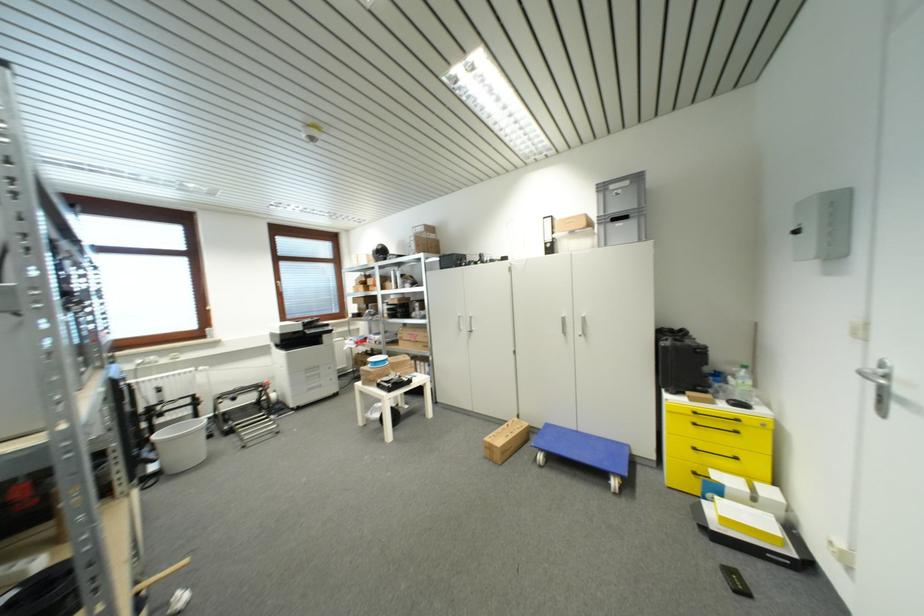
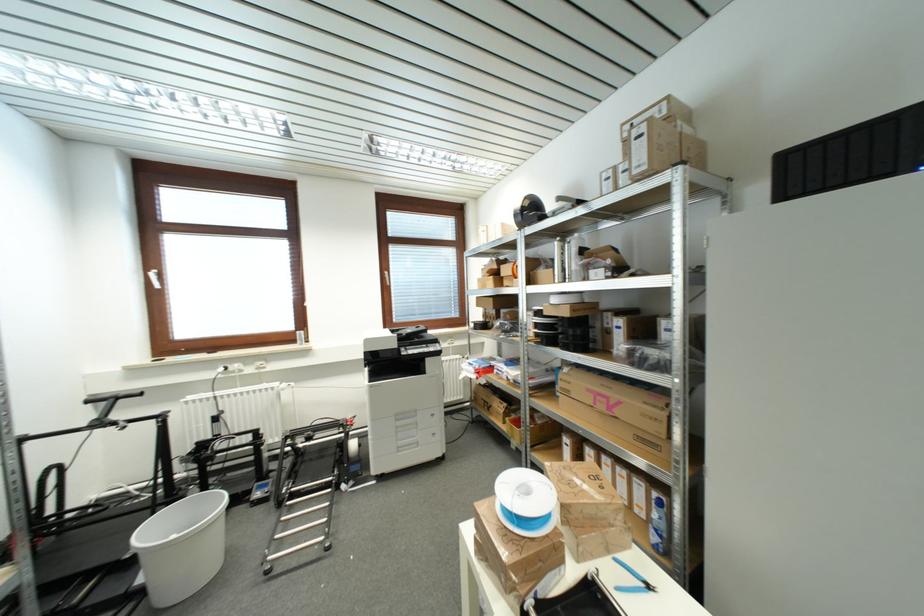
Find the pixel in the second image that matches (x=225, y=400) in the first image.

(297, 438)